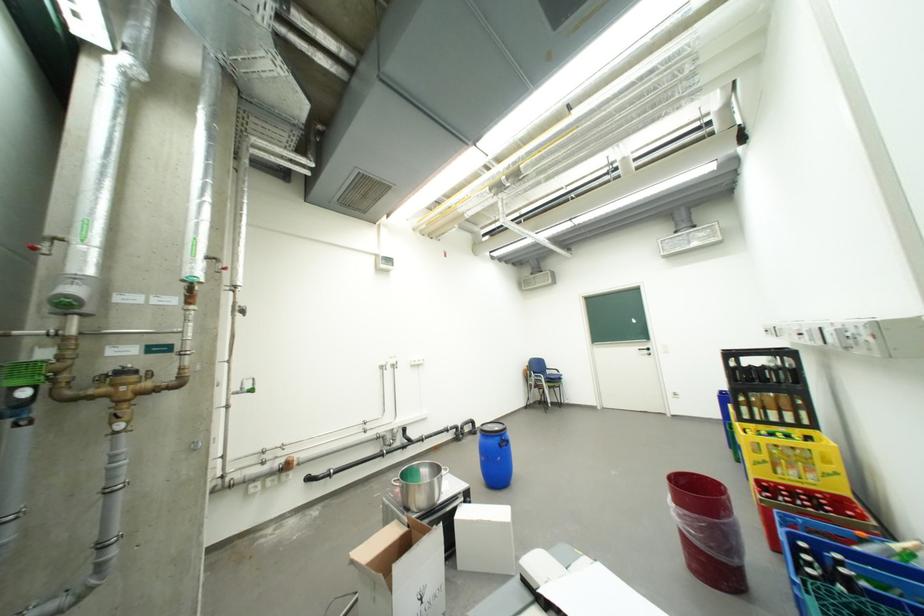
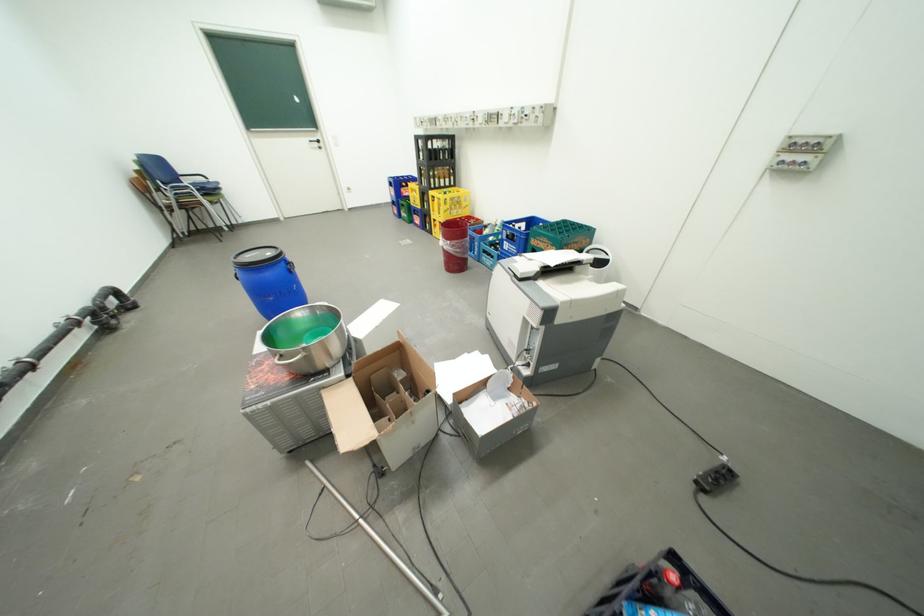
Locate, in the second image, the point that corresponds to (x=780, y=467) in the first image.

(459, 212)